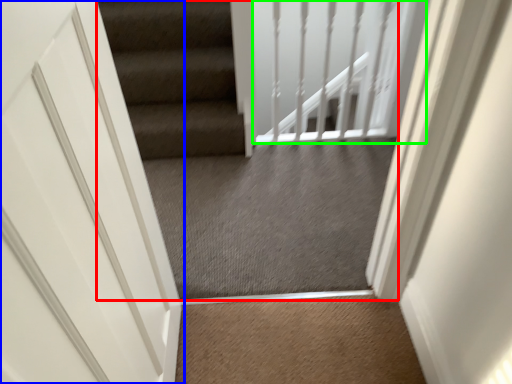
Question: Which is farther away from escalator (highlighted by a red box)? door (highlighted by a blue box) or balustrade (highlighted by a green box)?

Choices:
 (A) door
 (B) balustrade

Answer: (A)